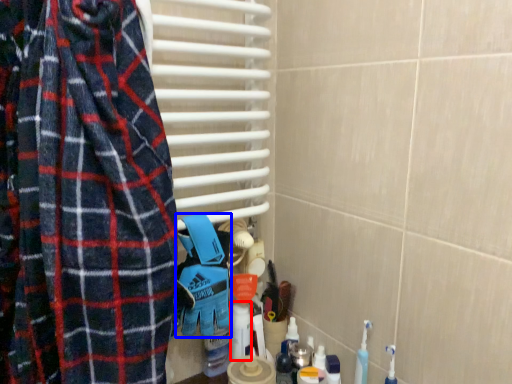
Question: Which object appears farthest to the camera in this image, cleaning product (highlighted by a red box) or blanket (highlighted by a blue box)?

Choices:
 (A) cleaning product
 (B) blanket

Answer: (A)